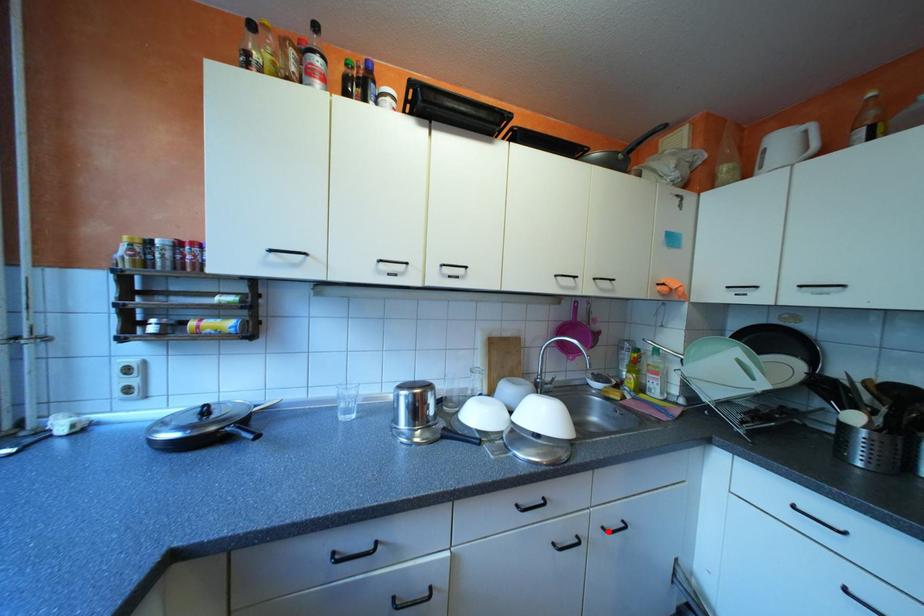
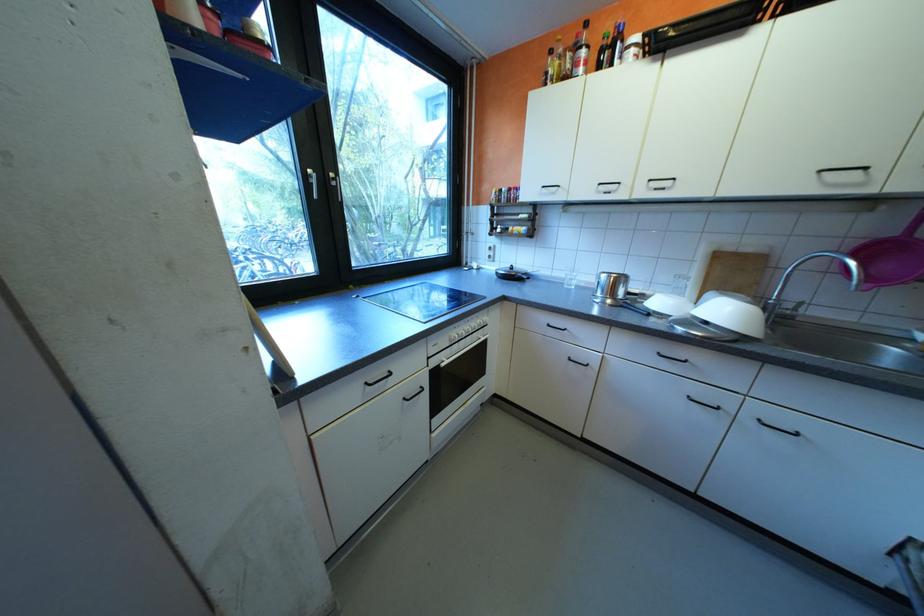
Locate, in the second image, the point that corresponds to the highlighted location in the first image.

(760, 419)